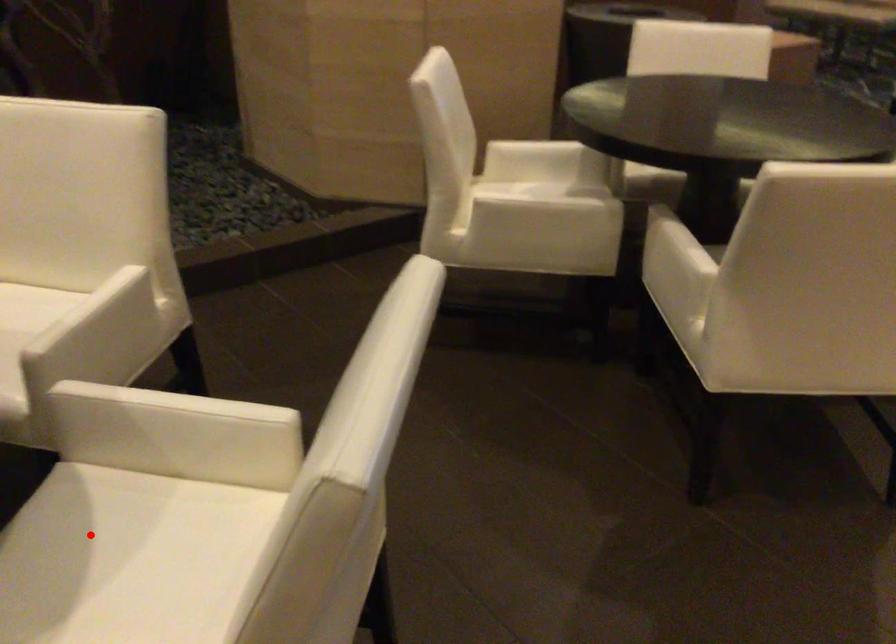
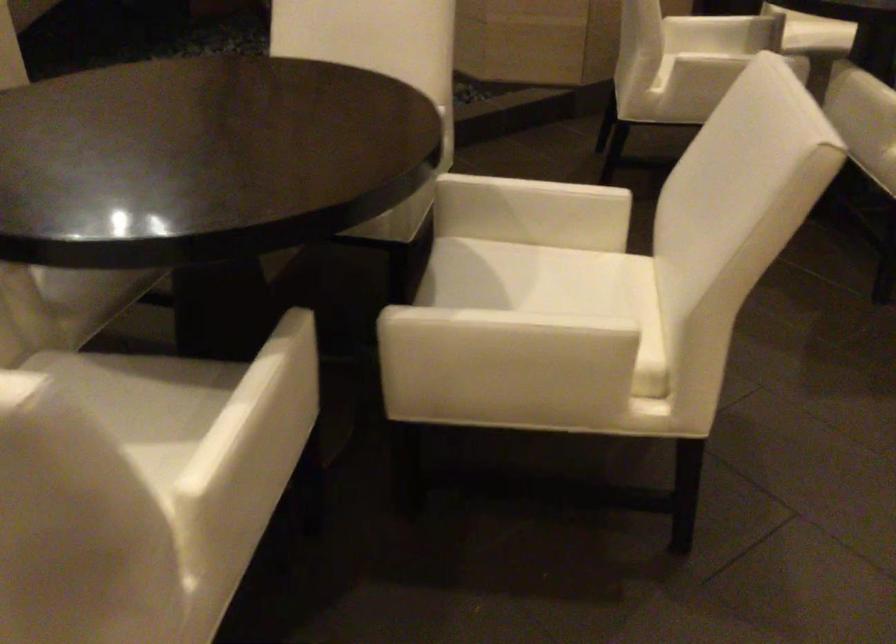
Locate, in the second image, the point that corresponds to the highlighted location in the first image.

(490, 272)